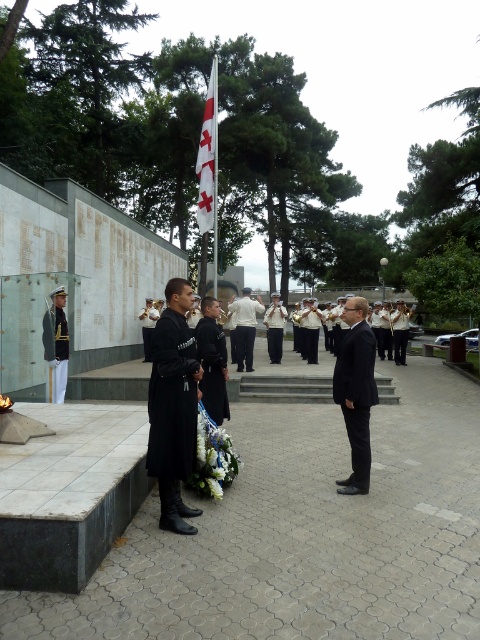
You are a photographer positioned at the center of the memorial site. You want to capture a photo that includes both the white fabric flag at center and the individual holding the bouquet of flowers. Based on their positions, can you determine if the flag will be fully visible in the frame without any obstruction?

The white fabric flag at center is located at point [208,157]. Since the flag is at the specified coordinates and the person with the bouquet is in the foreground, the flag should remain visible unless the person is directly blocking it. However, without exact positional data for the person, we can infer that the flag at center is likely visible as it is the central focus. Therefore, the flag will probably be fully visible in the frame.

You are a photographer positioned to the side of the ceremony. You need to capture a photo where both the dark suit at center and the white fabric flag at center are visible. Based on their sizes, which object will appear smaller in the photo?

The dark suit at center will appear smaller in the photo because it has a lesser width compared to the white fabric flag at center.

You are a photographer at the ceremony. You need to capture a photo where both the black matte uniform at center and the white shirt at center are visible. Which subject should you focus on to ensure both are in frame without zooming in or out?

You should focus on the black matte uniform at center because it is smaller in size compared to the white shirt at center, so keeping it centered will allow the larger white shirt at center to still be within the frame.